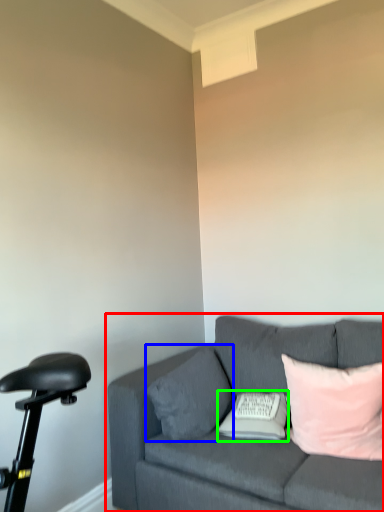
Question: Which object is positioned closest to studio couch (highlighted by a red box)? Select from pillow (highlighted by a blue box) and pillow (highlighted by a green box).

Choices:
 (A) pillow
 (B) pillow

Answer: (A)